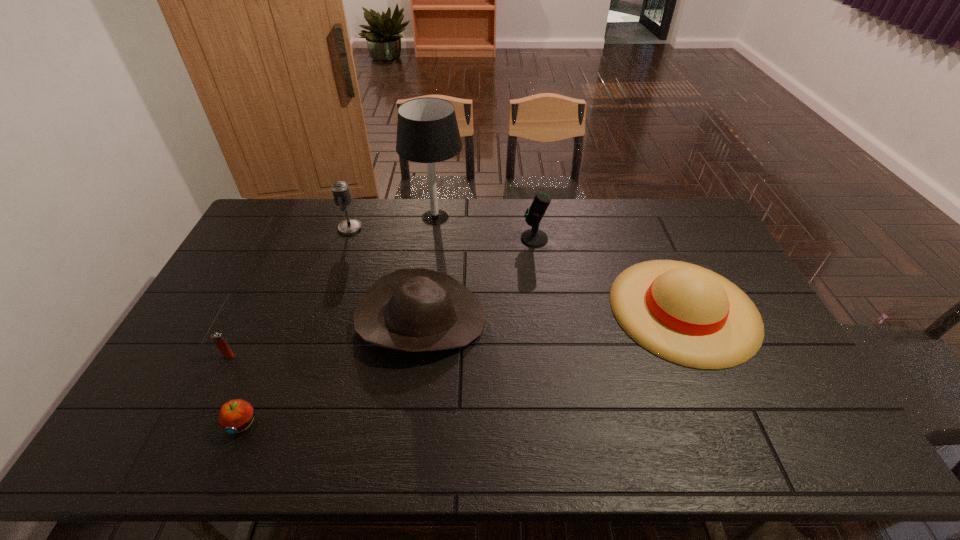
This screenshot has width=960, height=540. I want to click on table lamp, so click(427, 131).

What are the coordinates of `the left microphone` in the screenshot? It's located at (340, 189).

At what (x,y) coordinates should I click in order to perform the action: click on the sixth object from left to right. Please return your answer as a coordinate pair (x, y). This screenshot has width=960, height=540. Looking at the image, I should click on (533, 237).

The width and height of the screenshot is (960, 540). Find the location of `cowboy hat`. cowboy hat is located at coordinates (416, 309).

Where is `the rightmost object`? The image size is (960, 540). the rightmost object is located at coordinates (686, 314).

The width and height of the screenshot is (960, 540). Identify the location of the leftmost object. (217, 338).

Locate an element on the screen. the sixth object from right to left is located at coordinates (234, 416).

Locate an element on the screen. Image resolution: width=960 pixels, height=540 pixels. the nearest object is located at coordinates (234, 416).

Locate an element on the screen. vacant point located on the front of the table lamp is located at coordinates (429, 266).

Identify the location of vacant point located on the left of the left microphone. (262, 228).